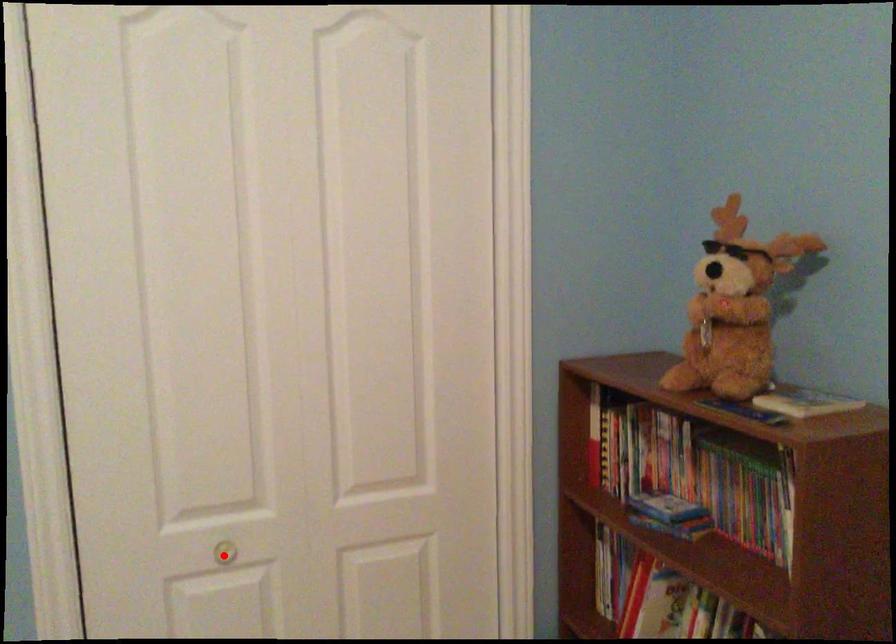
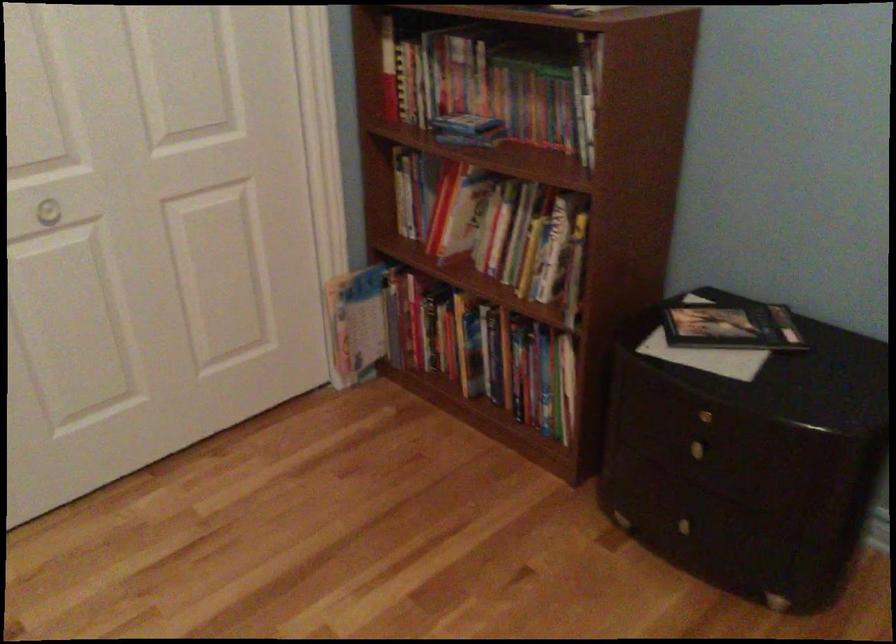
Locate, in the second image, the point that corresponds to the highlighted location in the first image.

(47, 212)